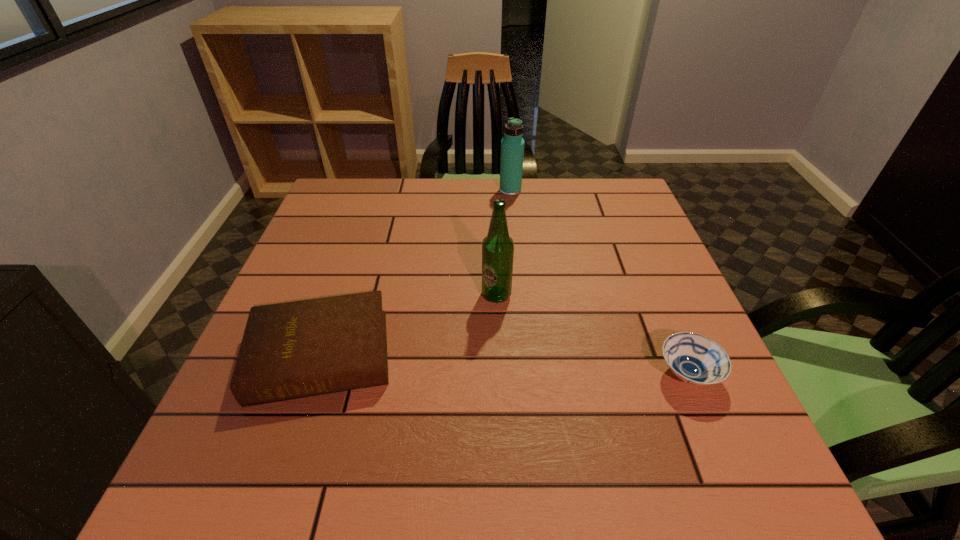
Where is `unoccupied area between the beer bottle and the rightmost object`? unoccupied area between the beer bottle and the rightmost object is located at coordinates (592, 334).

Identify the location of vacant space in between the Bible and the farthest object. The width and height of the screenshot is (960, 540). (416, 273).

Locate an element on the screen. vacant area that lies between the beer bottle and the leftmost object is located at coordinates (409, 325).

You are a GUI agent. You are given a task and a screenshot of the screen. Output one action in this format:
    pyautogui.click(x=<x>, y=<y>)
    Task: Click on the free space between the Bible and the shortest object
    The width and height of the screenshot is (960, 540).
    Given the screenshot: What is the action you would take?
    pyautogui.click(x=504, y=364)

Locate an element on the screen. empty space between the shortest object and the thermos bottle is located at coordinates (599, 282).

Locate an element on the screen. The width and height of the screenshot is (960, 540). vacant space that's between the soup bowl and the beer bottle is located at coordinates (592, 334).

I want to click on free space between the rightmost object and the beer bottle, so click(x=592, y=334).

Locate an element on the screen. object identified as the closest to the farthest object is located at coordinates (497, 247).

The height and width of the screenshot is (540, 960). I want to click on object that can be found as the third closest to the thermos bottle, so click(x=693, y=358).

Identify the location of free space in the image that satisfies the following two spatial constraints: 1. on the label of the beer bottle; 2. on the left side of the soup bowl. (499, 374).